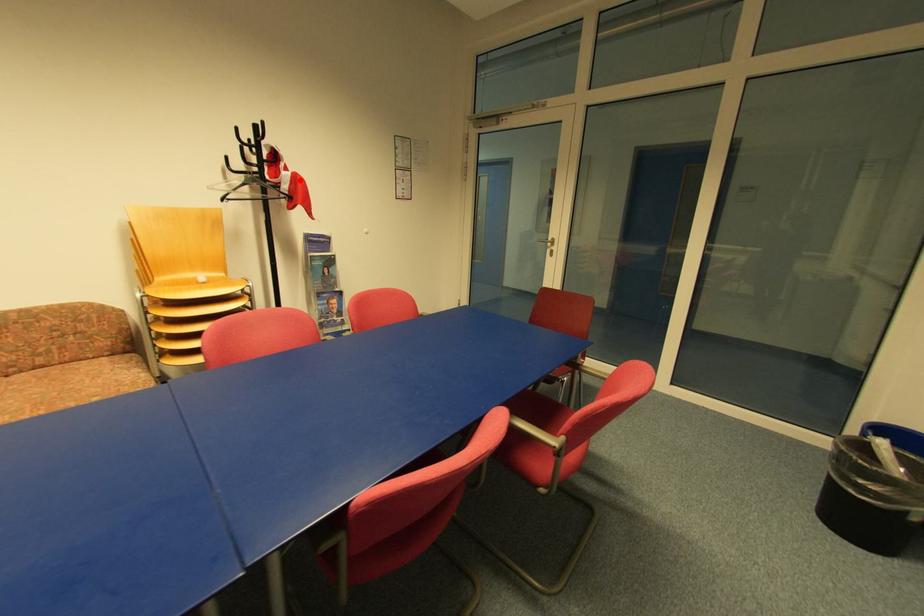
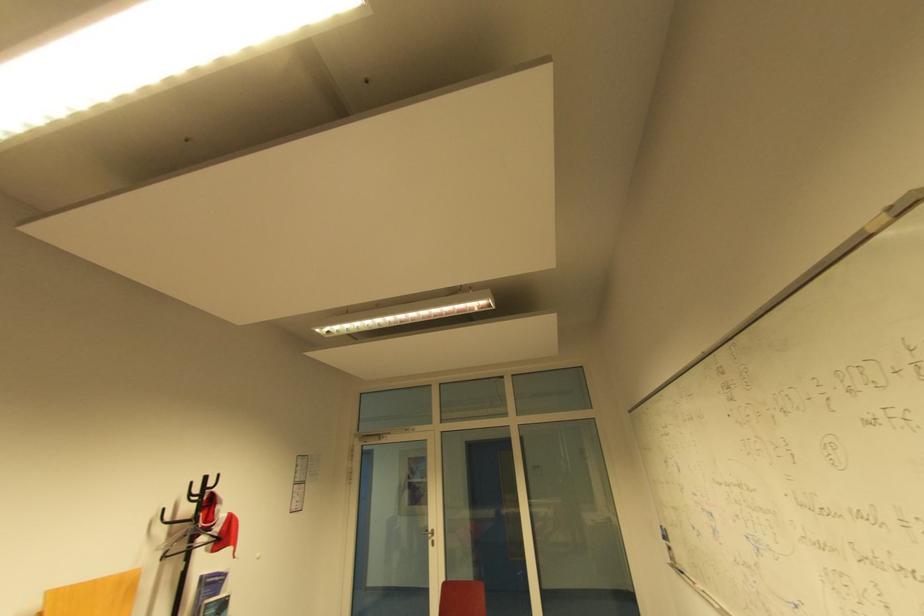
In the second image, find the point that corresponds to the highlighted location in the first image.

(235, 521)